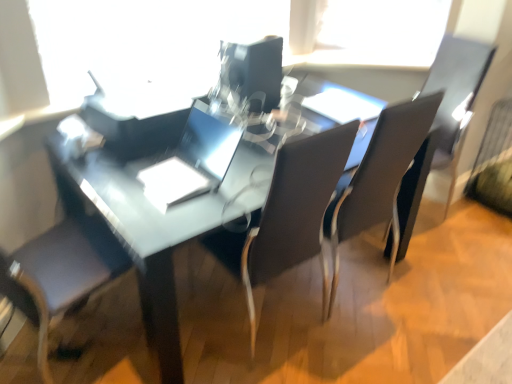
Question: Considering the positions of transparent plastic window screen at upper center and glossy plastic computer monitor at center in the image, is transparent plastic window screen at upper center taller or shorter than glossy plastic computer monitor at center?

Choices:
 (A) short
 (B) tall

Answer: (B)

Question: Looking at their shapes, would you say transparent plastic window screen at upper center is wider or thinner than glossy plastic computer monitor at center?

Choices:
 (A) thin
 (B) wide

Answer: (A)

Question: Which is nearer to the sleek silver laptop at center?

Choices:
 (A) matte black chair at center, the second chair when ordered from left to right
 (B) matte black armchair at right
 (C) glossy plastic computer monitor at center
 (D) matte black table at center
 (E) matte black chair at center, arranged as the 2th chair when viewed from the right

Answer: (D)

Question: Estimate the real-world distances between objects in this image. Which object is closer to the transparent plastic window screen at upper center?

Choices:
 (A) matte black table at center
 (B) glossy plastic computer monitor at center
 (C) sleek silver laptop at center
 (D) matte black chair at center, the second chair when ordered from left to right
 (E) matte black chair at center, arranged as the 2th chair when viewed from the right

Answer: (B)